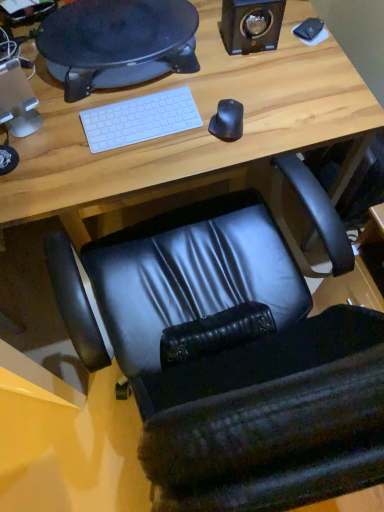
Where is `vacant region in front of white matte keyboard at center`? The height and width of the screenshot is (512, 384). vacant region in front of white matte keyboard at center is located at coordinates (127, 166).